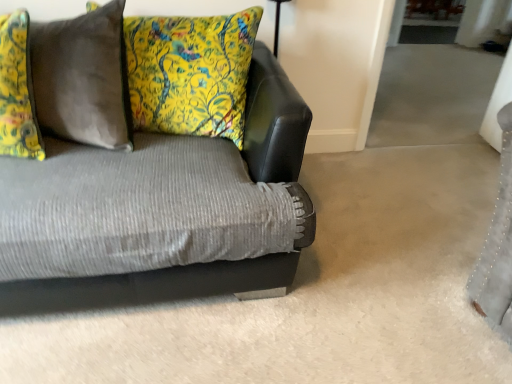
The height and width of the screenshot is (384, 512). What do you see at coordinates (83, 78) in the screenshot?
I see `velvet gray pillow at upper left, the 2th pillow positioned from the left` at bounding box center [83, 78].

Identify the location of yellow floral cushion at upper left, the third pillow viewed from the left. (190, 73).

Does floral fabric pillow at left, which is the first pillow in left-to-right order, have a lesser height compared to textured gray couch at center?

Correct, floral fabric pillow at left, which is the first pillow in left-to-right order, is not as tall as textured gray couch at center.

Does floral fabric pillow at left, which is the first pillow in left-to-right order, turn towards textured gray couch at center?

Yes, floral fabric pillow at left, which is the first pillow in left-to-right order, is aimed at textured gray couch at center.

In the scene shown: From the image's perspective, which one is positioned lower, floral fabric pillow at left, the 3th pillow from the right, or textured gray couch at center?

textured gray couch at center, from the image's perspective.

Which object is positioned more to the left, yellow floral cushion at upper left, the 1th pillow positioned from the right, or floral fabric pillow at left, the 3th pillow from the right?

floral fabric pillow at left, the 3th pillow from the right, is more to the left.

Based on the photo, is yellow floral cushion at upper left, the 1th pillow positioned from the right, oriented towards floral fabric pillow at left, the 3th pillow from the right?

Yes, yellow floral cushion at upper left, the 1th pillow positioned from the right, is aimed at floral fabric pillow at left, the 3th pillow from the right.

Is the surface of yellow floral cushion at upper left, the 1th pillow positioned from the right, in direct contact with floral fabric pillow at left, which is the first pillow in left-to-right order?

yellow floral cushion at upper left, the 1th pillow positioned from the right, is not next to floral fabric pillow at left, which is the first pillow in left-to-right order, and they're not touching.

How many degrees apart are the facing directions of yellow floral cushion at upper left, the third pillow viewed from the left, and floral fabric pillow at left, the 3th pillow from the right?

2.81 degrees.

Which is behind, yellow floral cushion at upper left, the 1th pillow positioned from the right, or textured gray couch at center?

Positioned behind is yellow floral cushion at upper left, the 1th pillow positioned from the right.

Could you measure the distance between yellow floral cushion at upper left, the 1th pillow positioned from the right, and textured gray couch at center?

The distance of yellow floral cushion at upper left, the 1th pillow positioned from the right, from textured gray couch at center is 28.29 inches.

Can textured gray couch at center be found inside yellow floral cushion at upper left, the third pillow viewed from the left?

No, yellow floral cushion at upper left, the third pillow viewed from the left, does not contain textured gray couch at center.

Measure the distance from floral fabric pillow at left, which is the first pillow in left-to-right order, to velvet gray pillow at upper left, the 2th pillow positioned from the left.

The distance of floral fabric pillow at left, which is the first pillow in left-to-right order, from velvet gray pillow at upper left, the 2th pillow positioned from the left, is 5.93 inches.

Does floral fabric pillow at left, the 3th pillow from the right, have a lesser width compared to velvet gray pillow at upper left, the 2th pillow positioned from the left?

Correct, the width of floral fabric pillow at left, the 3th pillow from the right, is less than that of velvet gray pillow at upper left, the 2th pillow positioned from the left.

Can you confirm if floral fabric pillow at left, which is the first pillow in left-to-right order, is positioned to the left of velvet gray pillow at upper left, the 2th pillow positioned from the left?

Yes, floral fabric pillow at left, which is the first pillow in left-to-right order, is to the left of velvet gray pillow at upper left, the 2th pillow positioned from the left.

Considering the points (23, 103) and (106, 33), which point is in front, point (23, 103) or point (106, 33)?

The point (23, 103) is closer to the camera.

Between textured gray couch at center and floral fabric pillow at left, the 3th pillow from the right, which one has smaller size?

floral fabric pillow at left, the 3th pillow from the right, is smaller.

Which object is thinner, textured gray couch at center or floral fabric pillow at left, which is the first pillow in left-to-right order?

floral fabric pillow at left, which is the first pillow in left-to-right order, is thinner.

Considering the relative positions of textured gray couch at center and floral fabric pillow at left, which is the first pillow in left-to-right order, in the image provided, is textured gray couch at center to the right of floral fabric pillow at left, which is the first pillow in left-to-right order, from the viewer's perspective?

Yes, textured gray couch at center is to the right of floral fabric pillow at left, which is the first pillow in left-to-right order.

From a real-world perspective, is textured gray couch at center positioned over floral fabric pillow at left, which is the first pillow in left-to-right order, based on gravity?

No, from a real-world perspective, textured gray couch at center is not over floral fabric pillow at left, which is the first pillow in left-to-right order

Which object is wider, yellow floral cushion at upper left, the 1th pillow positioned from the right, or velvet gray pillow at upper left, the 2th pillow positioned from the left?

yellow floral cushion at upper left, the 1th pillow positioned from the right.

Does point (153, 19) lie behind point (41, 122)?

That is True.

Is yellow floral cushion at upper left, the third pillow viewed from the left, outside of velvet gray pillow at upper left, the 2th pillow from the right?

Yes, yellow floral cushion at upper left, the third pillow viewed from the left, is outside of velvet gray pillow at upper left, the 2th pillow from the right.

From the image's perspective, is yellow floral cushion at upper left, the third pillow viewed from the left, under velvet gray pillow at upper left, the 2th pillow from the right?

Actually, yellow floral cushion at upper left, the third pillow viewed from the left, appears above velvet gray pillow at upper left, the 2th pillow from the right, in the image.

From the image's perspective, which is above, floral fabric pillow at left, the 3th pillow from the right, or yellow floral cushion at upper left, the 1th pillow positioned from the right?

yellow floral cushion at upper left, the 1th pillow positioned from the right, is shown above in the image.

Does floral fabric pillow at left, which is the first pillow in left-to-right order, contain yellow floral cushion at upper left, the third pillow viewed from the left?

That's incorrect, yellow floral cushion at upper left, the third pillow viewed from the left, is not inside floral fabric pillow at left, which is the first pillow in left-to-right order.

Is floral fabric pillow at left, the 3th pillow from the right, looking in the opposite direction of yellow floral cushion at upper left, the 1th pillow positioned from the right?

No, floral fabric pillow at left, the 3th pillow from the right, is not facing the opposite direction of yellow floral cushion at upper left, the 1th pillow positioned from the right.

There is a textured gray couch at center. What are the coordinates of `the 1st pillow above it (from the image's perspective)` in the screenshot? It's located at (17, 91).

The height and width of the screenshot is (384, 512). Identify the location of the 2nd pillow in front when counting from the yellow floral cushion at upper left, the third pillow viewed from the left. (17, 91).

When comparing their distances from floral fabric pillow at left, the 3th pillow from the right, does yellow floral cushion at upper left, the third pillow viewed from the left, or textured gray couch at center seem further?

textured gray couch at center is positioned further to the anchor floral fabric pillow at left, the 3th pillow from the right.

Considering their positions, is textured gray couch at center positioned further to yellow floral cushion at upper left, the third pillow viewed from the left, than velvet gray pillow at upper left, the 2th pillow positioned from the left?

textured gray couch at center lies further to yellow floral cushion at upper left, the third pillow viewed from the left, than the other object.

Which object lies nearer to the anchor point yellow floral cushion at upper left, the 1th pillow positioned from the right, textured gray couch at center or floral fabric pillow at left, which is the first pillow in left-to-right order?

floral fabric pillow at left, which is the first pillow in left-to-right order.

Considering their positions, is textured gray couch at center positioned further to floral fabric pillow at left, which is the first pillow in left-to-right order, than velvet gray pillow at upper left, the 2th pillow positioned from the left?

The object further to floral fabric pillow at left, which is the first pillow in left-to-right order, is textured gray couch at center.

Which object lies nearer to the anchor point floral fabric pillow at left, the 3th pillow from the right, velvet gray pillow at upper left, the 2th pillow from the right, or yellow floral cushion at upper left, the third pillow viewed from the left?

Among the two, velvet gray pillow at upper left, the 2th pillow from the right, is located nearer to floral fabric pillow at left, the 3th pillow from the right.

Based on the photo, which object lies nearer to the anchor point yellow floral cushion at upper left, the 1th pillow positioned from the right, floral fabric pillow at left, the 3th pillow from the right, or velvet gray pillow at upper left, the 2th pillow from the right?

velvet gray pillow at upper left, the 2th pillow from the right.

Based on their spatial positions, is floral fabric pillow at left, the 3th pillow from the right, or velvet gray pillow at upper left, the 2th pillow from the right, closer to textured gray couch at center?

Among the two, floral fabric pillow at left, the 3th pillow from the right, is located nearer to textured gray couch at center.

Looking at this image, based on their spatial positions, is floral fabric pillow at left, the 3th pillow from the right, or yellow floral cushion at upper left, the 1th pillow positioned from the right, closer to textured gray couch at center?

floral fabric pillow at left, the 3th pillow from the right, is positioned closer to the anchor textured gray couch at center.

Locate an element on the screen. Image resolution: width=512 pixels, height=384 pixels. pillow between floral fabric pillow at left, which is the first pillow in left-to-right order, and yellow floral cushion at upper left, the third pillow viewed from the left is located at coordinates (x=83, y=78).

Where is `pillow located between floral fabric pillow at left, which is the first pillow in left-to-right order, and textured gray couch at center in the left-right direction`? This screenshot has width=512, height=384. pillow located between floral fabric pillow at left, which is the first pillow in left-to-right order, and textured gray couch at center in the left-right direction is located at coordinates (83, 78).

Locate an element on the screen. Image resolution: width=512 pixels, height=384 pixels. studio couch between floral fabric pillow at left, which is the first pillow in left-to-right order, and yellow floral cushion at upper left, the third pillow viewed from the left is located at coordinates (152, 286).